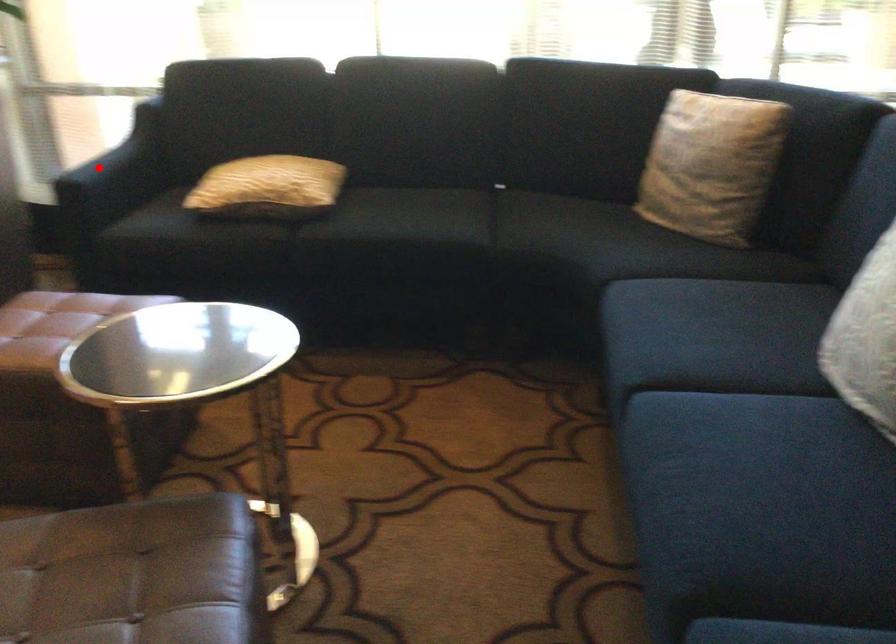
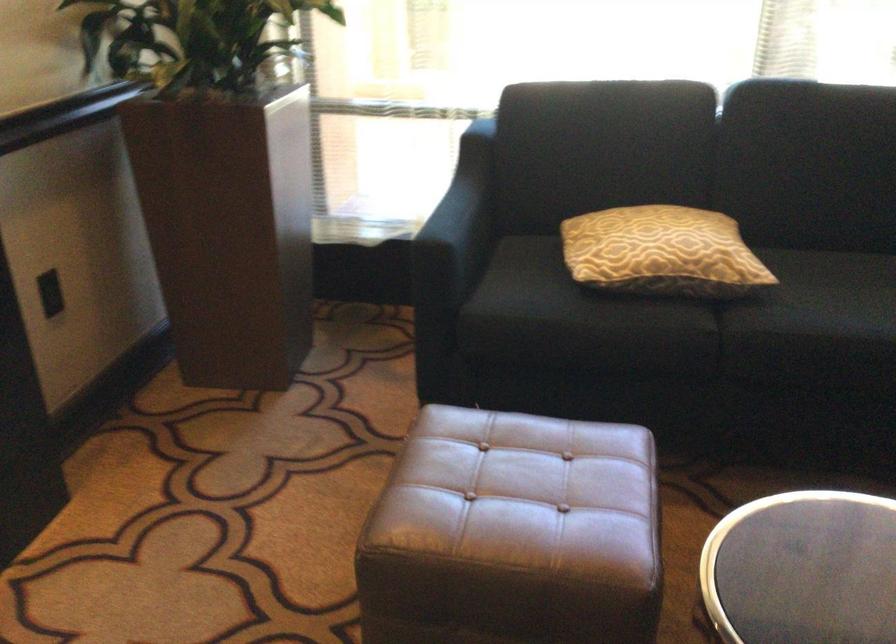
Question: A red point is marked in image1. In image2, is the corresponding 3D point closer to the camera or farther? Reply with the corresponding letter.

Choices:
 (A) The corresponding 3D point is closer.
 (B) The corresponding 3D point is farther.

Answer: (A)